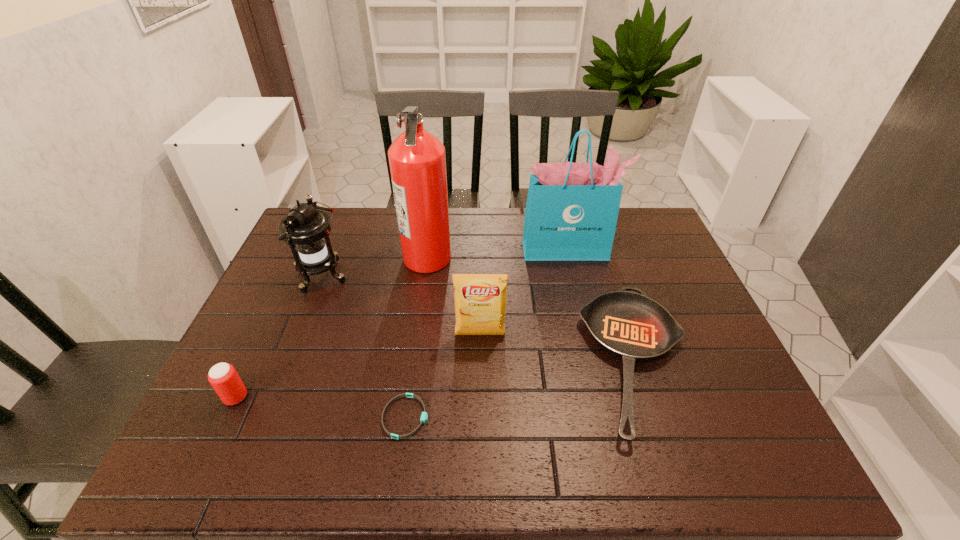
Identify the location of free space located on the back of the lantern. The image size is (960, 540). (346, 215).

The height and width of the screenshot is (540, 960). I want to click on vacant space located 0.230m on the front of the crisp (potato chip) with the logo, so click(480, 424).

Where is `vacant space located on the front of the beer can`? This screenshot has width=960, height=540. vacant space located on the front of the beer can is located at coordinates (206, 460).

Locate an element on the screen. This screenshot has width=960, height=540. free spot located 0.340m on the left of the frying pan is located at coordinates (446, 360).

Where is `vacant space located on the buckle of the wristband`? The image size is (960, 540). vacant space located on the buckle of the wristband is located at coordinates (474, 417).

The height and width of the screenshot is (540, 960). I want to click on fire extinguisher that is at the far edge, so click(x=417, y=160).

Locate an element on the screen. Image resolution: width=960 pixels, height=540 pixels. shopping bag situated at the far edge is located at coordinates (571, 214).

The image size is (960, 540). Find the location of `frying pan that is at the near edge`. frying pan that is at the near edge is located at coordinates (632, 326).

The image size is (960, 540). I want to click on wristband at the near edge, so click(x=424, y=416).

This screenshot has width=960, height=540. I want to click on lantern that is at the left edge, so click(306, 230).